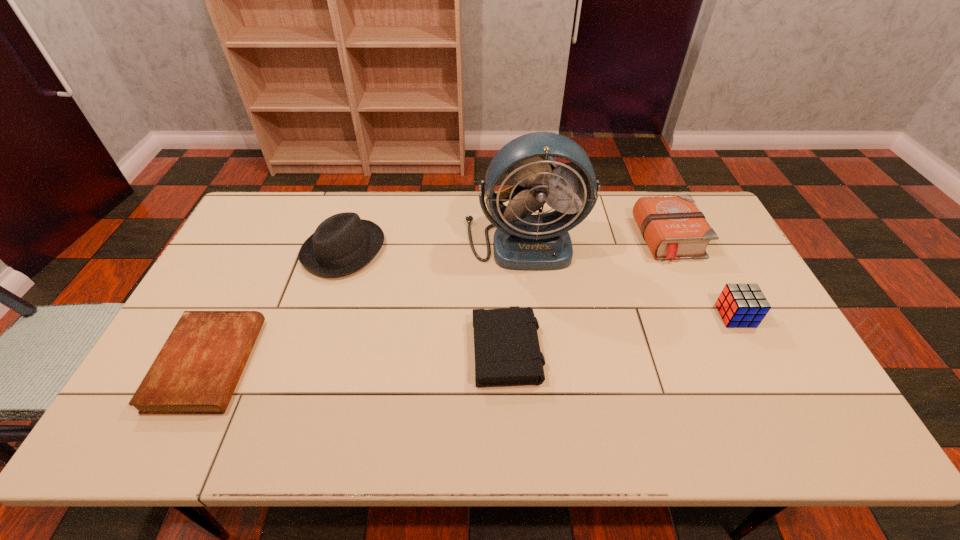
The width and height of the screenshot is (960, 540). Identify the location of fan. (541, 242).

Locate an element on the screen. This screenshot has height=540, width=960. the fifth object from right to left is located at coordinates (343, 243).

Identify the location of the fifth shortest object. (343, 243).

Locate an element on the screen. the rightmost Bible is located at coordinates (673, 227).

Identify the location of the tallest Bible. (673, 227).

Identify the location of cube. This screenshot has height=540, width=960. (740, 305).

This screenshot has width=960, height=540. Find the location of `the second Bible from right to left`. the second Bible from right to left is located at coordinates (507, 352).

Identify the location of the fifth tallest object. (507, 352).

Identify the location of the shortest Bible. (198, 368).

You are a GUI agent. You are given a task and a screenshot of the screen. Output one action in this format:
    pyautogui.click(x=<x>, y=<y>)
    Task: Click on the leftmost Bible
    The width and height of the screenshot is (960, 540).
    Given the screenshot: What is the action you would take?
    pyautogui.click(x=198, y=368)